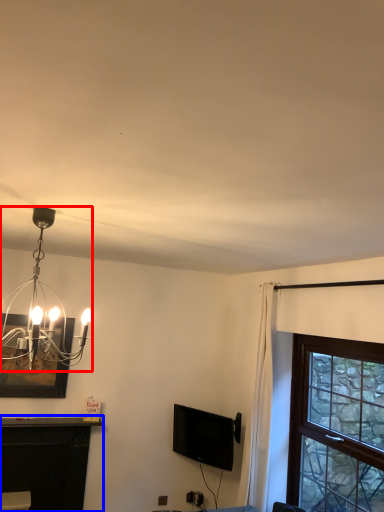
Question: Which point is further to the camera, lamp (highlighted by a red box) or table (highlighted by a blue box)?

Choices:
 (A) lamp
 (B) table

Answer: (B)